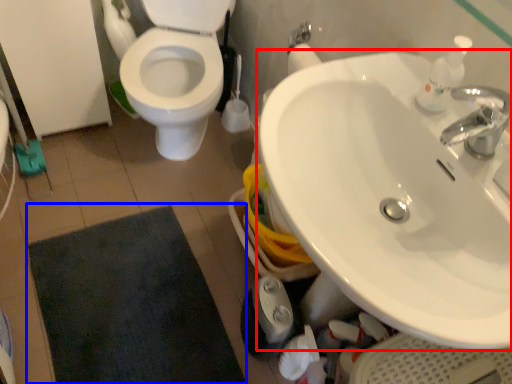
Question: Which of the following is the closest to the observer, sink (highlighted by a red box) or bath mat (highlighted by a blue box)?

Choices:
 (A) sink
 (B) bath mat

Answer: (A)